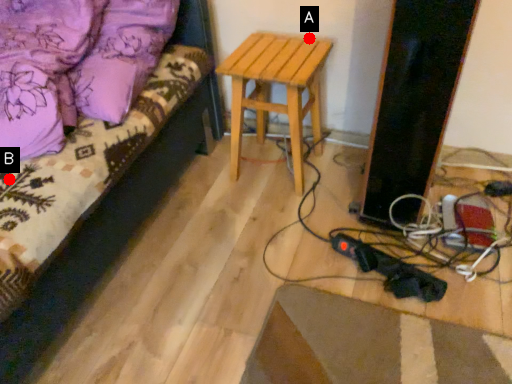
Question: Two points are circled on the image, labeled by A and B beside each circle. Among these points, which one is farthest from the camera?

Choices:
 (A) A is further
 (B) B is further

Answer: (A)